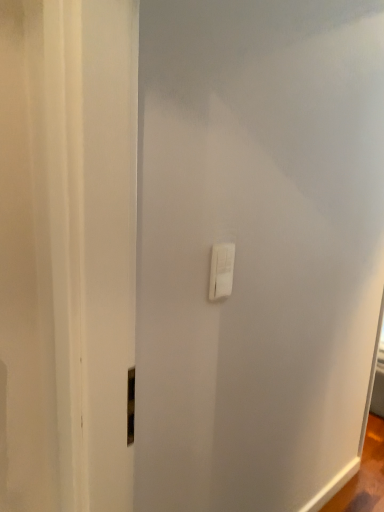
What do you see at coordinates (221, 270) in the screenshot?
I see `white plastic light switch at center` at bounding box center [221, 270].

Locate an element on the screen. Image resolution: width=384 pixels, height=512 pixels. white plastic light switch at center is located at coordinates (221, 270).

Identify the location of white plastic light switch at center. (221, 270).